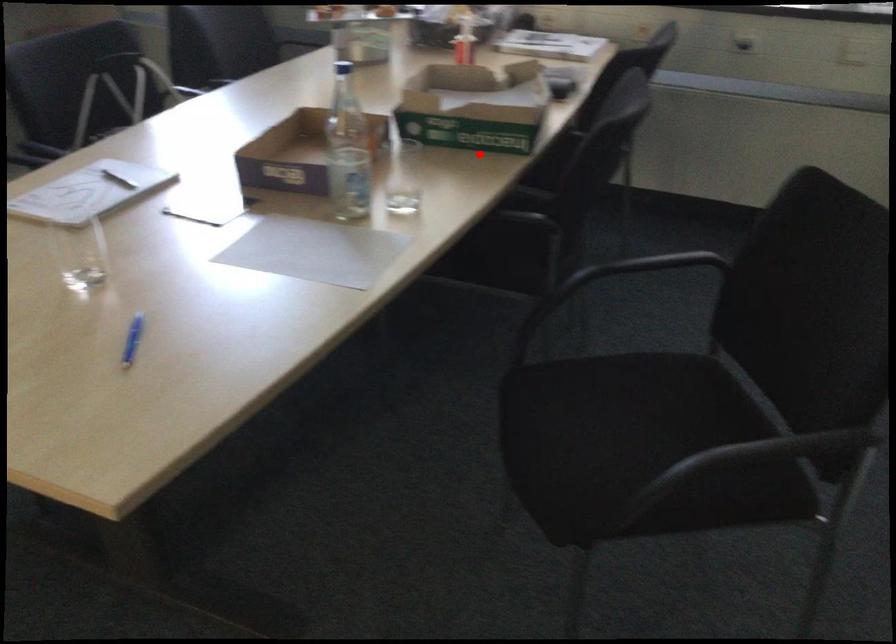
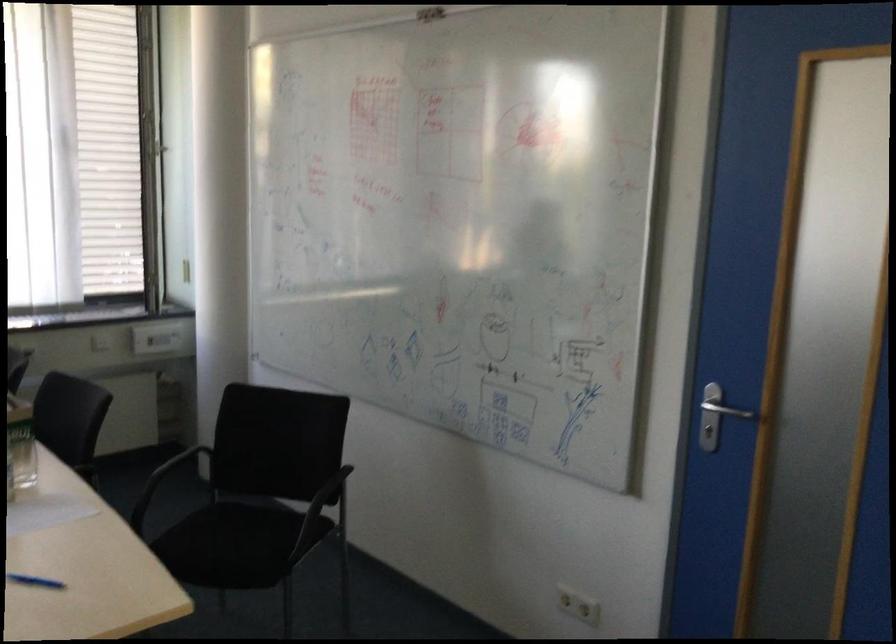
Question: I am providing you with two images of the same scene from different viewpoints. Image1 has a red point marked. In image2, the corresponding 3D location appears at what relative position? Reply with the corresponding letter.

Choices:
 (A) Closer
 (B) Farther

Answer: (B)